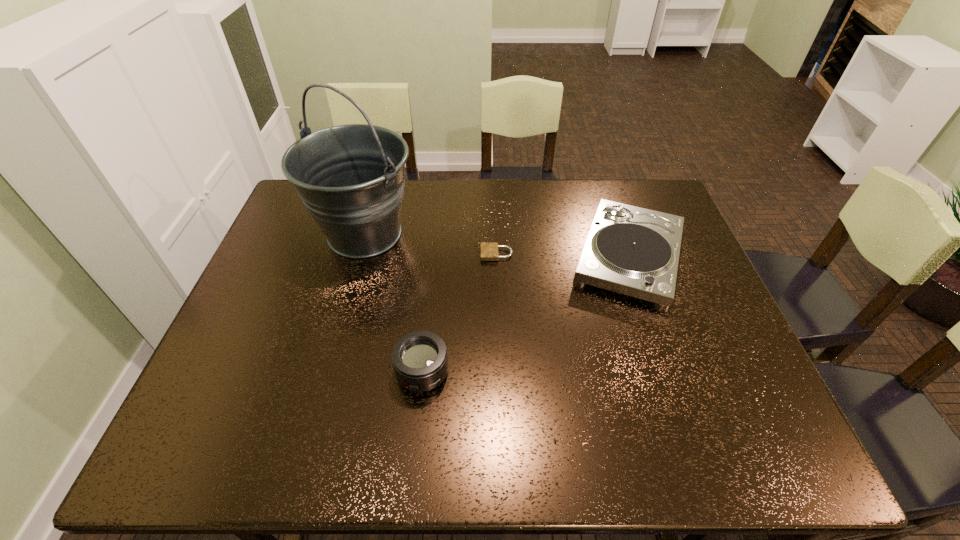
Find the location of a particular element. vacant region at the far left corner of the desktop is located at coordinates (297, 202).

You are a GUI agent. You are given a task and a screenshot of the screen. Output one action in this format:
    pyautogui.click(x=<x>, y=<y>)
    Task: Click on the vacant position at the far right corner of the desktop
    The image size is (960, 540).
    Given the screenshot: What is the action you would take?
    click(x=620, y=186)

This screenshot has height=540, width=960. Find the location of `free point between the tallest object and the telephoto lens`. free point between the tallest object and the telephoto lens is located at coordinates (394, 303).

Find the location of a particular element. free space that is in between the second object from right to left and the telephoto lens is located at coordinates (460, 313).

Locate an element on the screen. The height and width of the screenshot is (540, 960). free spot between the nearest object and the bucket is located at coordinates (394, 303).

Image resolution: width=960 pixels, height=540 pixels. I want to click on unoccupied position between the tallest object and the third object from left to right, so click(431, 244).

You are a GUI agent. You are given a task and a screenshot of the screen. Output one action in this format:
    pyautogui.click(x=<x>, y=<y>)
    Task: Click on the free spot between the shortest object and the rightmost object
    
    Given the screenshot: What is the action you would take?
    pyautogui.click(x=563, y=255)

This screenshot has height=540, width=960. What are the coordinates of `vacant space that's between the shortest object and the bucket` in the screenshot? It's located at (431, 244).

What are the coordinates of `free space between the telephoto lens and the rightmost object` in the screenshot? It's located at (525, 315).

Identify which object is located as the nearest to the record player. Please provide its 2D coordinates. Your answer should be formatted as a tuple, i.e. [(x, y)], where the tuple contains the x and y coordinates of a point satisfying the conditions above.

[(489, 250)]